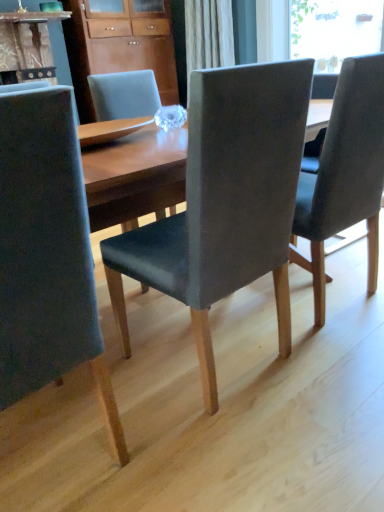
Image resolution: width=384 pixels, height=512 pixels. Identify the location of free space in front of dark gray fabric chair at center, acting as the third chair starting from the left. (338, 361).